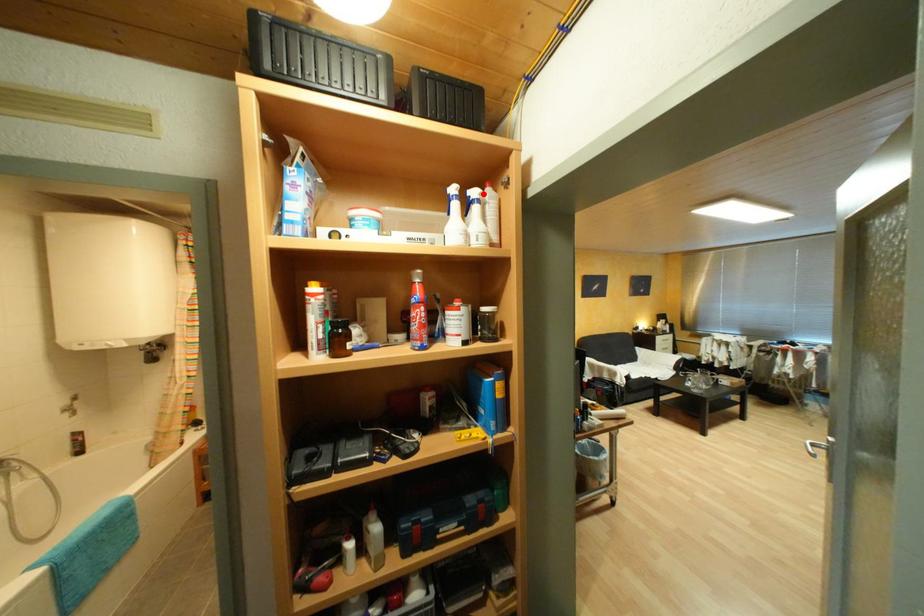
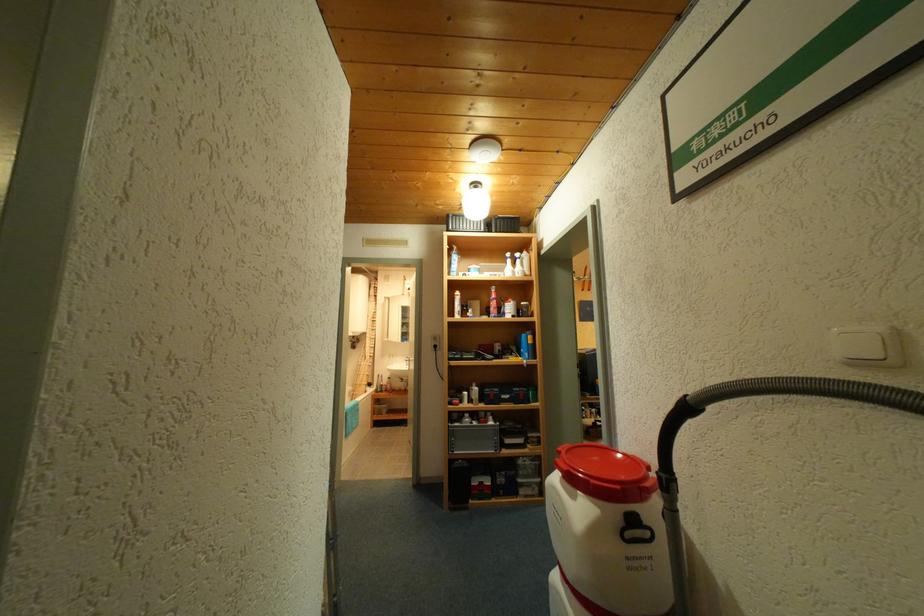
The point at the highlighted location is marked in the first image. Where is the corresponding point in the second image?

(527, 256)